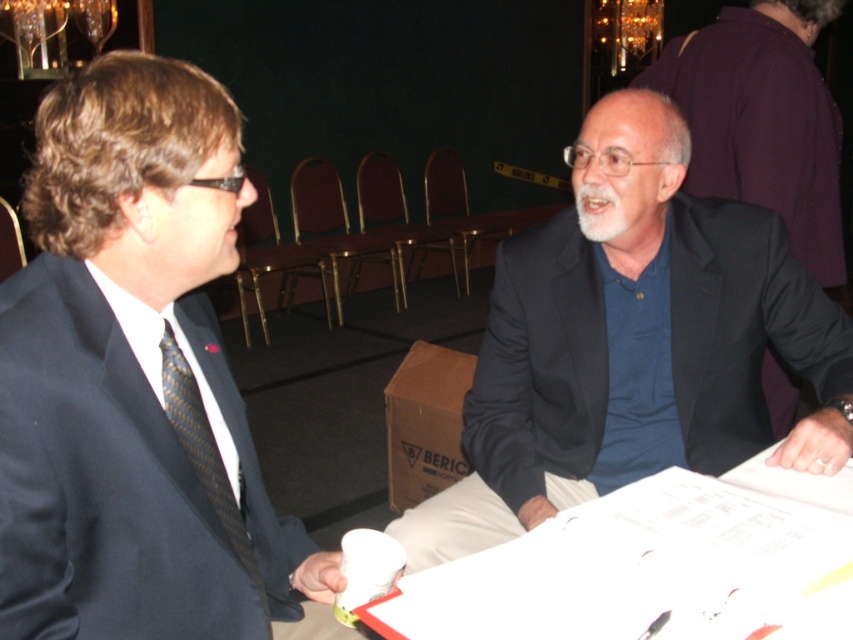
Question: Can you confirm if dark blue suit at right is thinner than white paper at center?

Choices:
 (A) no
 (B) yes

Answer: (A)

Question: Does matte black suit at left appear on the left side of dark blue suit at right?

Choices:
 (A) no
 (B) yes

Answer: (B)

Question: Does dark blue suit at right appear under black striped tie at left?

Choices:
 (A) yes
 (B) no

Answer: (B)

Question: Estimate the real-world distances between objects in this image. Which object is farther from the white paper at center?

Choices:
 (A) black striped tie at left
 (B) matte black suit at left
 (C) dark blue suit at right

Answer: (A)

Question: Which object appears closest to the camera in this image?

Choices:
 (A) black striped tie at left
 (B) white paper at center

Answer: (B)

Question: Which point is farther to the camera?

Choices:
 (A) matte black suit at left
 (B) dark blue suit at right
 (C) white paper at center

Answer: (B)